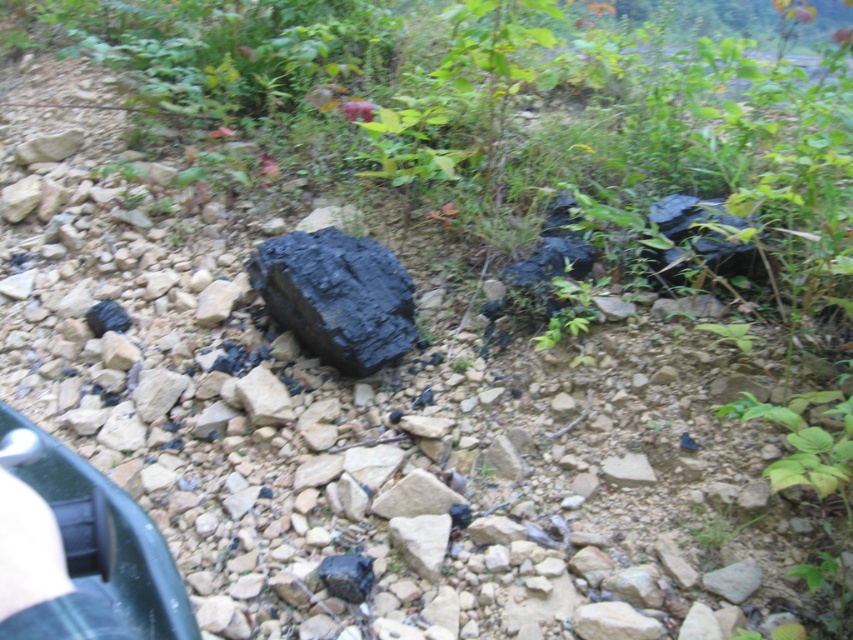
You are a hiker who just found a blue denim jeans at lower left in the rocky terrain. You also see a black matte rock at center. How far apart are these two items?

The black matte rock at center and blue denim jeans at lower left are 1.47 meters apart.

You are standing at the edge of the rocky terrain and see the black matte rock at center and the blue denim jeans at lower left. Which object is located to the right of the other?

The black matte rock at center is positioned on the right side of blue denim jeans at lower left.

You are a hiker who has just found a black matte rock at center and blue denim jeans at lower left in the rocky terrain. Which object is bigger in size?

The black matte rock at center is larger in size compared to the blue denim jeans at lower left.